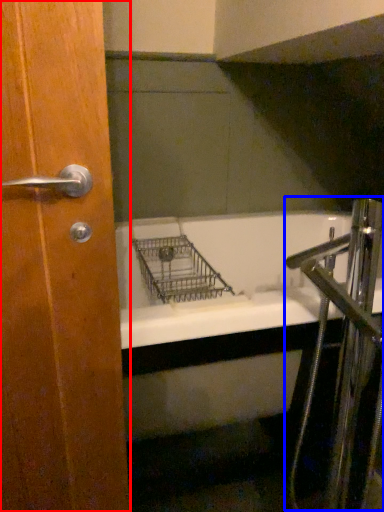
Question: Which object is closer to the camera taking this photo, door (highlighted by a red box) or faucet (highlighted by a blue box)?

Choices:
 (A) door
 (B) faucet

Answer: (A)